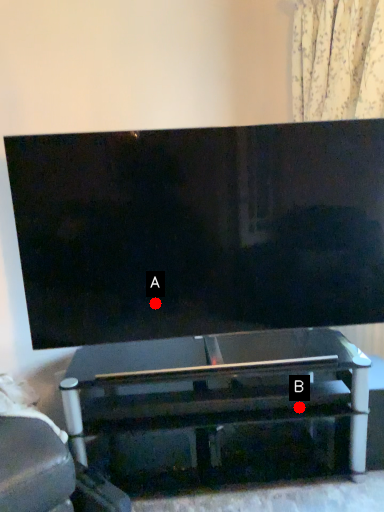
Question: Two points are circled on the image, labeled by A and B beside each circle. Among these points, which one is nearest to the camera?

Choices:
 (A) A is closer
 (B) B is closer

Answer: (B)